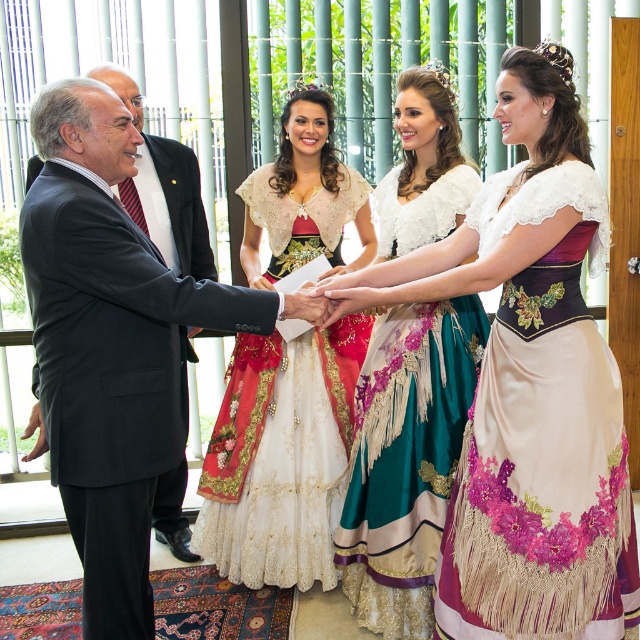
Question: Does purple satin dress at center have a lesser width compared to silk satin dress at center?

Choices:
 (A) yes
 (B) no

Answer: (B)

Question: Is black suit at left to the left of white lace dress at center from the viewer's perspective?

Choices:
 (A) yes
 (B) no

Answer: (A)

Question: In this image, where is black suit at left located relative to purple satin dress at center?

Choices:
 (A) below
 (B) above

Answer: (B)

Question: Which point is closer to the camera?

Choices:
 (A) (301, 513)
 (B) (138, 337)

Answer: (B)

Question: Which object is positioned farthest from the silk satin dress at center?

Choices:
 (A) white lace dress at center
 (B) black suit at left

Answer: (B)

Question: Which of these objects is positioned farthest from the purple satin dress at center?

Choices:
 (A) black suit at left
 (B) white lace dress at center
 (C) silk satin dress at center

Answer: (A)